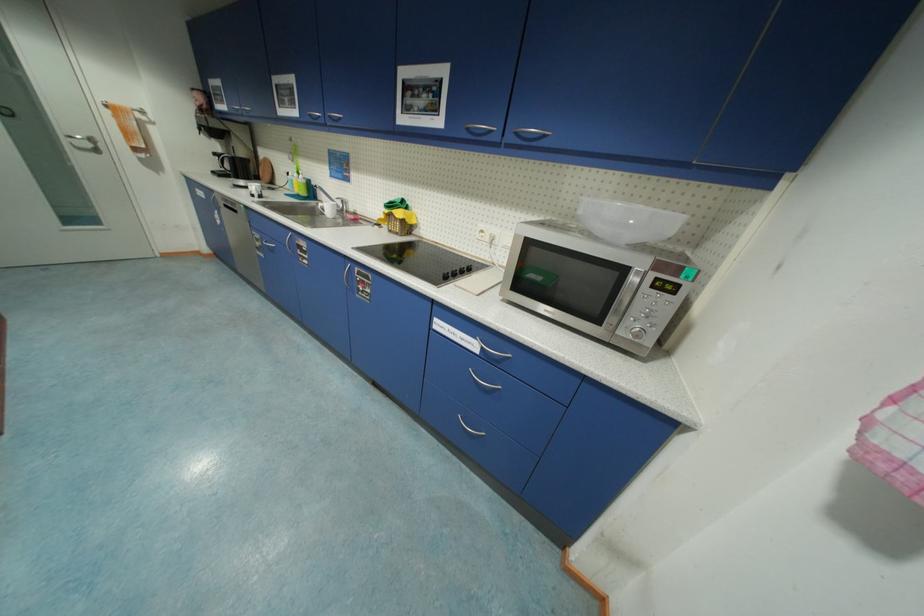
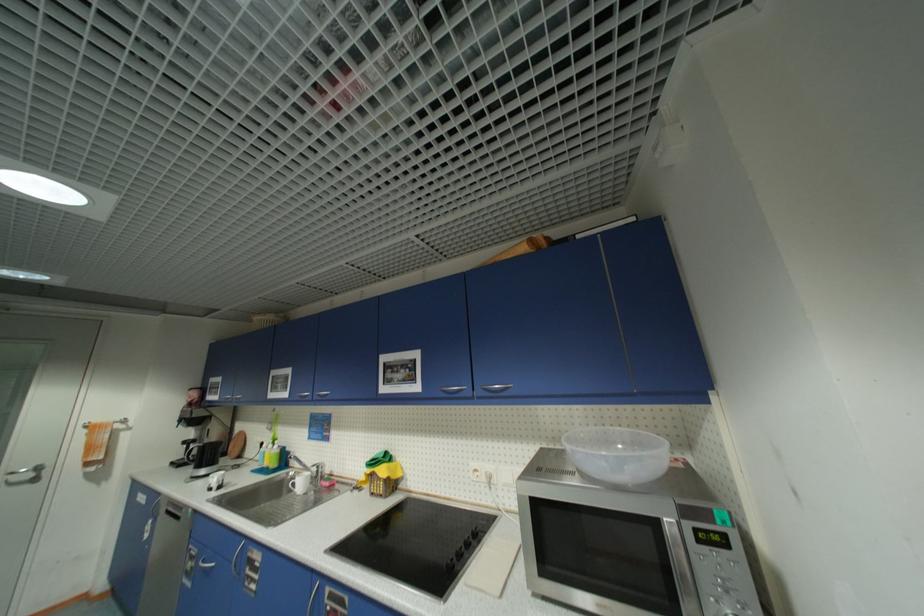
Find the pixel in the second image that matches point (222, 156) in the first image.

(190, 444)